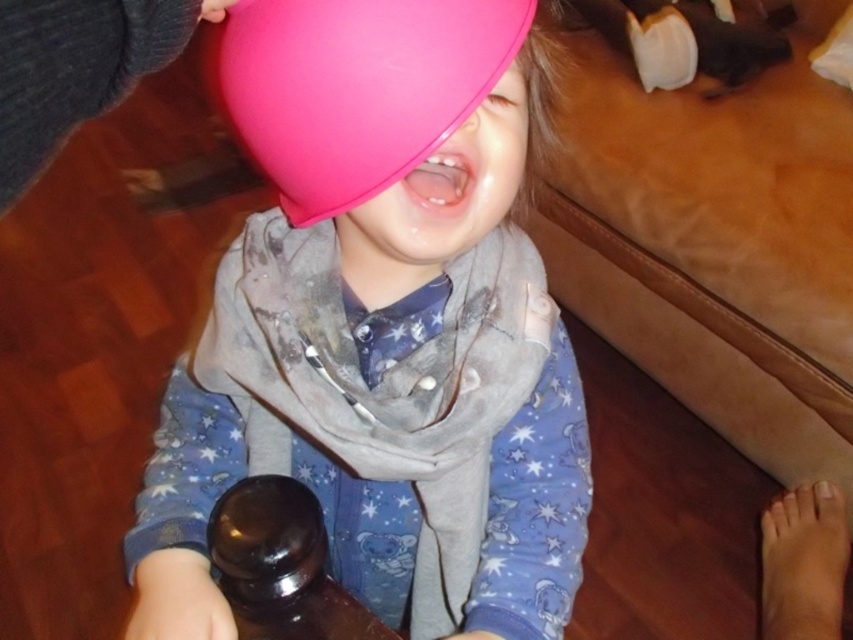
You are a photographer trying to capture the best angle of the scene. You notice two points in the image at coordinates point (299, 333) and point (476, 64). Which point is closer to your camera lens?

Point (299, 333) is further to the camera than point (476, 64), so the point closer to the camera lens is point (476, 64).

You are a parent trying to choose a balloon for your child. The child is sitting on the floor and has two balloons in front of them. The matte pink balloon at center and the pink rubber balloon at upper center. Which balloon is bigger?

The matte pink balloon at center is bigger than the pink rubber balloon at upper center according to the description.

You are a parent trying to ensure your child can safely reach both the matte pink balloon at center and the pink rubber balloon at upper center. Given that the child can only stretch their arms 6 inches, can they reach both balloons without moving?

The distance between the matte pink balloon at center and the pink rubber balloon at upper center is 6.12 inches. Since the child can only stretch their arms 6 inches, they cannot reach both balloons without moving.